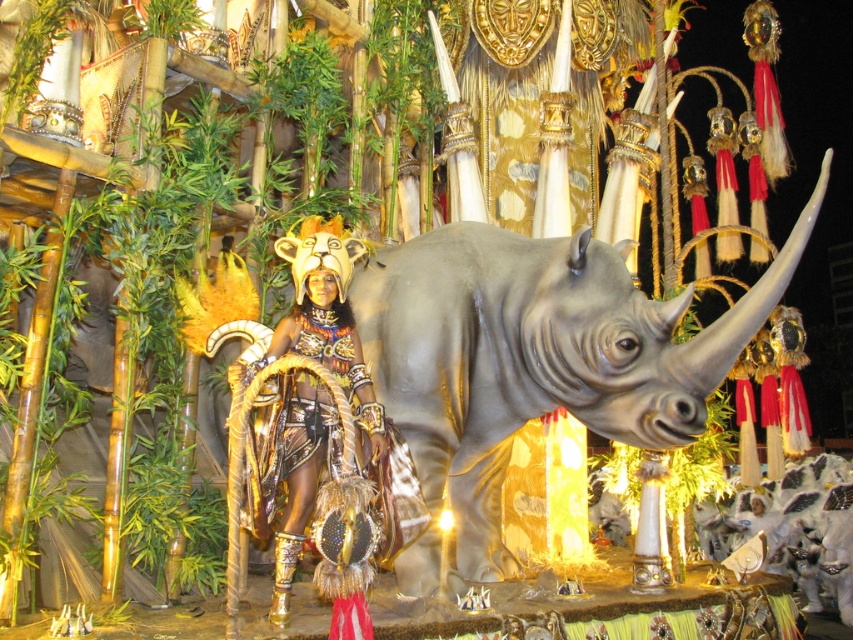
You are a photographer trying to capture both the gray matte rhinoceros at center and the metallic gold headdress at center in a single frame. Given that your camera has a maximum focus range of 7 meters, will you be able to include both subjects in sharp focus?

The gray matte rhinoceros at center and metallic gold hehouse at center are 7.69 meters apart. Since the distance between them exceeds the camera s maximum focus range of 7 meters, you won t be able to capture both in sharp focus simultaneously.

You are a photographer positioned in front of the gray matte rhinoceros at center and the metallic gold headdress at center. You want to take a photo that captures both subjects clearly. Which subject should you focus on first to ensure both are in focus?

You should focus on the gray matte rhinoceros at center first because it is closer to you than the metallic gold headdress at center. By focusing on the closer subject, the farther one will also be in focus due to the depth of field.